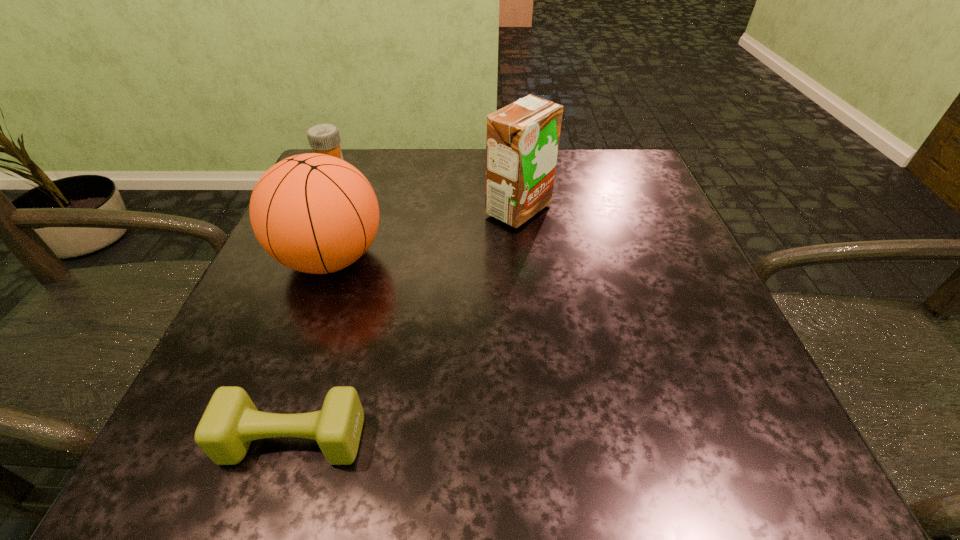
Locate an element on the screen. This screenshot has height=540, width=960. blank space located on the label side of the farthest object is located at coordinates point(458,171).

This screenshot has height=540, width=960. I want to click on vacant region located on the right of the nearest object, so click(x=644, y=440).

Image resolution: width=960 pixels, height=540 pixels. I want to click on carton that is at the far edge, so click(x=522, y=139).

At what (x,y) coordinates should I click in order to perform the action: click on medicine at the far edge. Please return your answer as a coordinate pair (x, y). The image size is (960, 540). Looking at the image, I should click on (324, 138).

The height and width of the screenshot is (540, 960). I want to click on object that is at the near edge, so click(x=231, y=421).

You are a GUI agent. You are given a task and a screenshot of the screen. Output one action in this format:
    pyautogui.click(x=<x>, y=<y>)
    Task: Click on the basketball at the left edge
    The image size is (960, 540).
    Given the screenshot: What is the action you would take?
    pyautogui.click(x=314, y=213)

Identify the location of medicine that is positioned at the left edge. This screenshot has width=960, height=540. (324, 138).

Where is `dumbbell situated at the left edge`? dumbbell situated at the left edge is located at coordinates (231, 421).

Identify the location of object positioned at the far left corner. (324, 138).

You are a GUI agent. You are given a task and a screenshot of the screen. Output one action in this format:
    pyautogui.click(x=<x>, y=<y>)
    Task: Click on the object at the near left corner
    Image resolution: width=960 pixels, height=540 pixels.
    Given the screenshot: What is the action you would take?
    pyautogui.click(x=231, y=421)